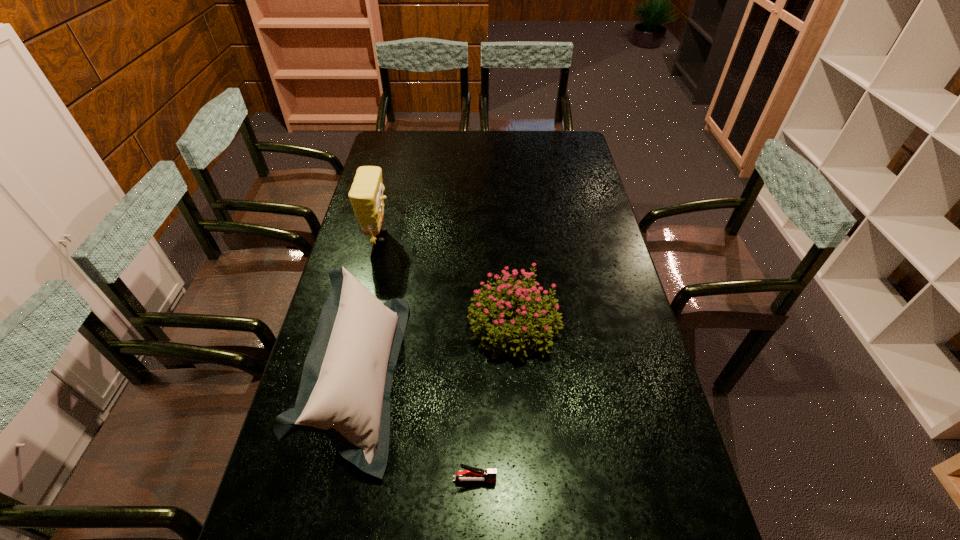
The image size is (960, 540). I want to click on free region at the far edge of the desktop, so click(x=540, y=145).

This screenshot has width=960, height=540. In order to click on vacant space at the left edge of the desktop in this screenshot , I will do `click(298, 459)`.

Identify the location of vacant region at the right edge. (607, 224).

Locate an element on the screen. The width and height of the screenshot is (960, 540). vacant area that lies between the stapler and the sponge is located at coordinates (427, 358).

Find the location of a particular element. The height and width of the screenshot is (540, 960). vacant region between the stapler and the bouquet is located at coordinates (494, 402).

Locate an element on the screen. This screenshot has height=540, width=960. free space between the farthest object and the shortest object is located at coordinates (427, 358).

Identify the location of free space between the stapler and the bouquet. (494, 402).

Identify the location of free space between the bouquet and the cushion. (438, 352).

Identify the location of vacant point located between the stapler and the bouquet. (494, 402).

Locate an element on the screen. free space between the farthest object and the bouquet is located at coordinates (446, 281).